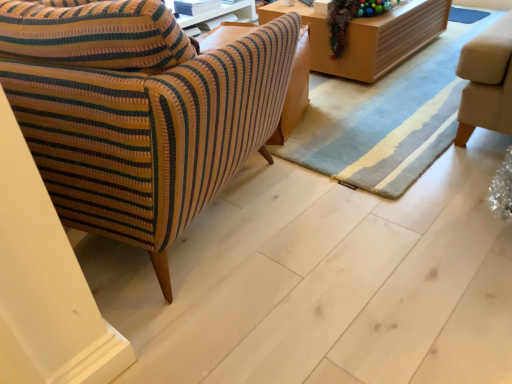
Question: Does striped fabric armchair at left come in front of shiny metallic garland at upper right?

Choices:
 (A) no
 (B) yes

Answer: (B)

Question: Is striped fabric armchair at left wider than shiny metallic garland at upper right?

Choices:
 (A) yes
 (B) no

Answer: (A)

Question: From the image's perspective, does striped fabric armchair at left appear higher than shiny metallic garland at upper right?

Choices:
 (A) no
 (B) yes

Answer: (A)

Question: Could you tell me if striped fabric armchair at left is facing shiny metallic garland at upper right?

Choices:
 (A) no
 (B) yes

Answer: (B)

Question: Is striped fabric armchair at left to the right of shiny metallic garland at upper right from the viewer's perspective?

Choices:
 (A) no
 (B) yes

Answer: (A)

Question: From the image's perspective, is striped fabric armchair at left under shiny metallic garland at upper right?

Choices:
 (A) no
 (B) yes

Answer: (B)

Question: Could you tell me if wooden table at upper center is turned towards striped fabric armchair at left?

Choices:
 (A) no
 (B) yes

Answer: (A)

Question: Can you confirm if wooden table at upper center is thinner than striped fabric armchair at left?

Choices:
 (A) yes
 (B) no

Answer: (A)

Question: Can you confirm if wooden table at upper center is positioned to the right of striped fabric armchair at left?

Choices:
 (A) yes
 (B) no

Answer: (A)

Question: Is wooden table at upper center located outside striped fabric armchair at left?

Choices:
 (A) no
 (B) yes

Answer: (B)

Question: Considering the relative sizes of wooden table at upper center and striped fabric armchair at left in the image provided, is wooden table at upper center wider than striped fabric armchair at left?

Choices:
 (A) yes
 (B) no

Answer: (B)

Question: Is the position of wooden table at upper center more distant than that of striped fabric armchair at left?

Choices:
 (A) no
 (B) yes

Answer: (B)

Question: Considering the relative sizes of shiny metallic garland at upper right and wooden table at upper center in the image provided, is shiny metallic garland at upper right wider than wooden table at upper center?

Choices:
 (A) no
 (B) yes

Answer: (A)